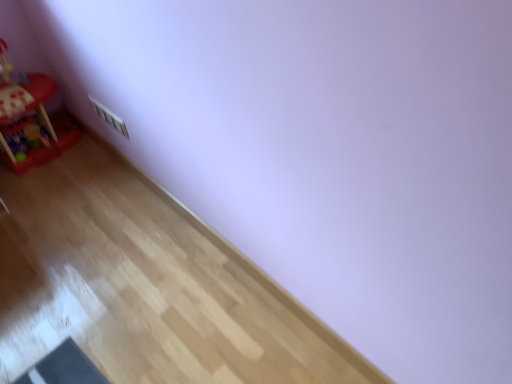
Where is `vacant space to the right of matte plastic toy at left`? The width and height of the screenshot is (512, 384). vacant space to the right of matte plastic toy at left is located at coordinates (83, 165).